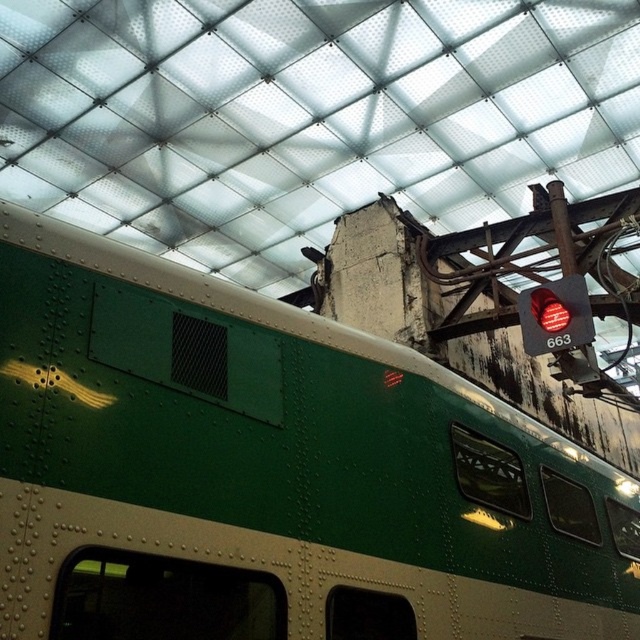
You are a passenger on the train and looking out the window. You notice the green riveted metal train at center and the red glass traffic light at upper right. Which object is closer to you?

The green riveted metal train at center is positioned under the red glass traffic light at upper right, meaning the green riveted metal train at center is closer to you since it is in front of the traffic light.

You are standing in front of the train car and notice two points marked on its side panel. The first point is at coordinate point [10,593] and the second is at point [561,330]. Which point would appear larger in your view?

Point [10,593] is closer to the camera than point [561,330], so it would appear larger in your view.